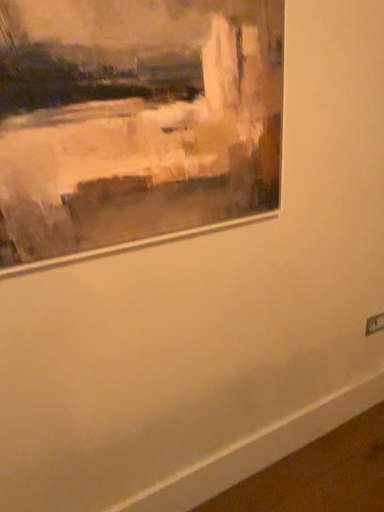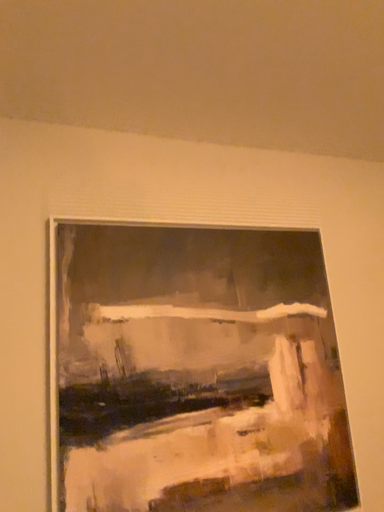
Question: Which way did the camera rotate in the video?

Choices:
 (A) rotated right
 (B) rotated left

Answer: (B)